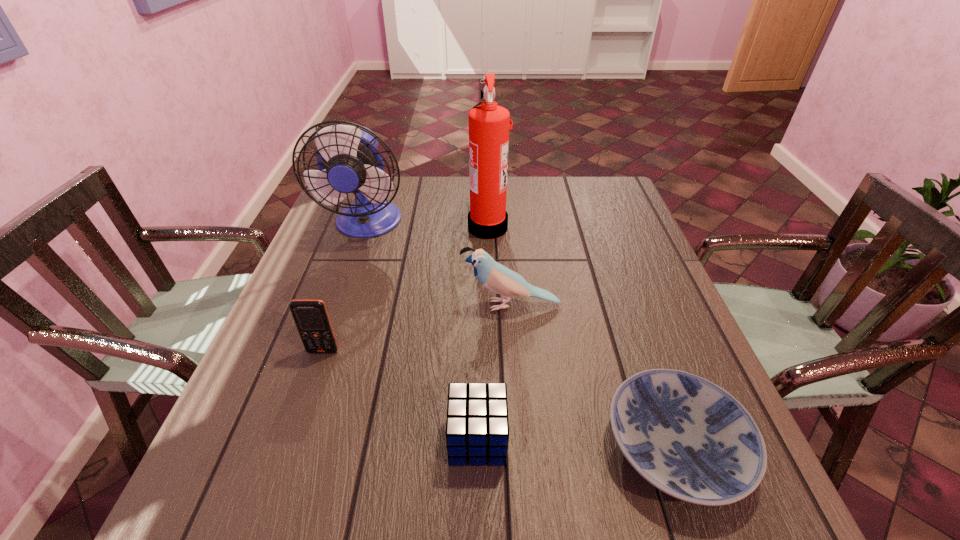
Image resolution: width=960 pixels, height=540 pixels. I want to click on free space between the plate and the second shortest object, so click(x=576, y=443).

Image resolution: width=960 pixels, height=540 pixels. I want to click on free space between the second shortest object and the tallest object, so click(483, 333).

Select which object appears as the fourth closest to the tallest object. Please provide its 2D coordinates. Your answer should be formatted as a tuple, i.e. [(x, y)], where the tuple contains the x and y coordinates of a point satisfying the conditions above.

[(688, 437)]

At what (x,y) coordinates should I click in order to perform the action: click on object that can be found as the fifth closest to the second tallest object. Please return your answer as a coordinate pair (x, y). Looking at the image, I should click on (688, 437).

Where is `blank area in the image that satisfies the following two spatial constraints: 1. on the screen of the plate; 2. on the left side of the cellular telephone`? blank area in the image that satisfies the following two spatial constraints: 1. on the screen of the plate; 2. on the left side of the cellular telephone is located at coordinates (291, 447).

The width and height of the screenshot is (960, 540). I want to click on free space in the image that satisfies the following two spatial constraints: 1. at the face of the third farthest object; 2. on the front side of the cube, so click(520, 439).

Identify the location of vacant space that satisfies the following two spatial constraints: 1. at the face of the rightmost object; 2. on the left side of the third farthest object. (521, 447).

Where is `vacant point that satisfies the following two spatial constraints: 1. on the screen of the plate; 2. on the right side of the cellular telephone`? The width and height of the screenshot is (960, 540). vacant point that satisfies the following two spatial constraints: 1. on the screen of the plate; 2. on the right side of the cellular telephone is located at coordinates (291, 447).

Find the location of `vacant space that satisfies the following two spatial constraints: 1. with the nozzle aimed from the shortest object; 2. on the right side of the tallest object`. vacant space that satisfies the following two spatial constraints: 1. with the nozzle aimed from the shortest object; 2. on the right side of the tallest object is located at coordinates (492, 447).

Where is `free space that satisfies the following two spatial constraints: 1. with the nozzle aimed from the tallest object; 2. on the screen of the fourth tallest object`? free space that satisfies the following two spatial constraints: 1. with the nozzle aimed from the tallest object; 2. on the screen of the fourth tallest object is located at coordinates (491, 352).